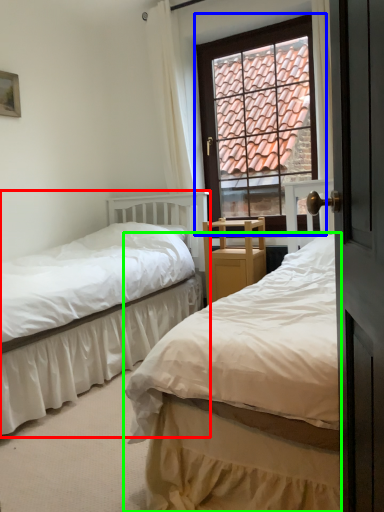
Question: Based on their relative distances, which object is farther from bed (highlighted by a red box)? Choose from window (highlighted by a blue box) and bed (highlighted by a green box).

Choices:
 (A) window
 (B) bed

Answer: (B)